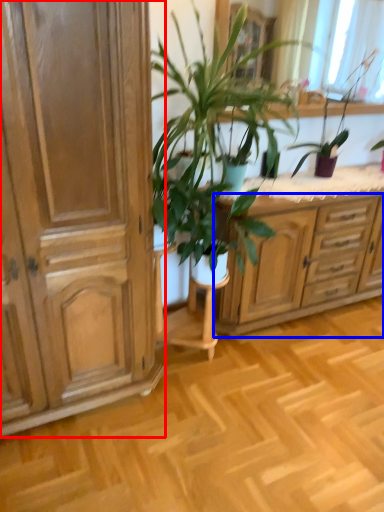
Question: Which object appears closest to the camera in this image, cabinetry (highlighted by a red box) or chest of drawers (highlighted by a blue box)?

Choices:
 (A) cabinetry
 (B) chest of drawers

Answer: (A)